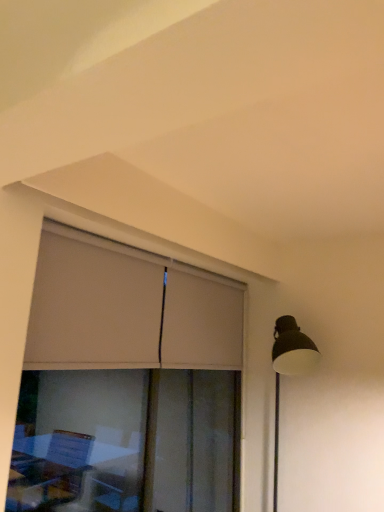
In order to click on beige fabric curtain at upper left in this screenshot , I will do `click(127, 309)`.

The width and height of the screenshot is (384, 512). Describe the element at coordinates (127, 309) in the screenshot. I see `beige fabric curtain at upper left` at that location.

In the scene shown: What is the approximate height of beige fabric curtain at upper left?

The height of beige fabric curtain at upper left is 26.19 inches.

Describe the element at coordinates (129, 309) in the screenshot. I see `matte beige window at center` at that location.

Find the location of a particular element. The height and width of the screenshot is (512, 384). matte beige window at center is located at coordinates tap(129, 309).

What are the coordinates of `beige fabric curtain at upper left` in the screenshot? It's located at (127, 309).

Which is more to the right, matte beige window at center or beige fabric curtain at upper left?

beige fabric curtain at upper left.

Considering the relative positions of matte beige window at center and beige fabric curtain at upper left in the image provided, is matte beige window at center in front of beige fabric curtain at upper left?

Yes, matte beige window at center is in front of beige fabric curtain at upper left.

Does point (130, 253) come in front of point (160, 354)?

Yes, point (130, 253) is closer to viewer.

Consider the image. From the image's perspective, is matte beige window at center beneath beige fabric curtain at upper left?

Correct, matte beige window at center appears lower than beige fabric curtain at upper left in the image.

From a real-world perspective, is matte beige window at center on top of beige fabric curtain at upper left?

No, from a real-world perspective, matte beige window at center is not on top of beige fabric curtain at upper left.

Between matte beige window at center and beige fabric curtain at upper left, which one has smaller width?

With smaller width is matte beige window at center.

Between matte beige window at center and beige fabric curtain at upper left, which one has less height?

beige fabric curtain at upper left is shorter.

Considering the sizes of objects matte beige window at center and beige fabric curtain at upper left in the image provided, who is smaller, matte beige window at center or beige fabric curtain at upper left?

Smaller between the two is beige fabric curtain at upper left.

Would you say matte beige window at center is inside or outside beige fabric curtain at upper left?

matte beige window at center can be found inside beige fabric curtain at upper left.

Is matte beige window at center in contact with beige fabric curtain at upper left?

Yes, matte beige window at center and beige fabric curtain at upper left clearly make contact.

Is matte beige window at center turned away from beige fabric curtain at upper left?

Correct, matte beige window at center is looking away from beige fabric curtain at upper left.

Locate an element on the screen. This screenshot has width=384, height=512. curtain behind the matte beige window at center is located at coordinates (127, 309).

Does beige fabric curtain at upper left appear on the left side of matte beige window at center?

In fact, beige fabric curtain at upper left is to the right of matte beige window at center.

Which object is more forward, beige fabric curtain at upper left or matte beige window at center?

matte beige window at center is in front.

Does point (79, 328) lie behind point (53, 329)?

Yes, point (79, 328) is farther from viewer.

From the image's perspective, who appears lower, beige fabric curtain at upper left or matte beige window at center?

From the image's view, matte beige window at center is below.

In the scene shown: From a real-world perspective, is beige fabric curtain at upper left physically located above or below matte beige window at center?

In terms of real-world spatial position, beige fabric curtain at upper left is above matte beige window at center.

Does beige fabric curtain at upper left have a greater width compared to matte beige window at center?

Yes, beige fabric curtain at upper left is wider than matte beige window at center.

Considering the sizes of objects beige fabric curtain at upper left and matte beige window at center in the image provided, who is taller, beige fabric curtain at upper left or matte beige window at center?

matte beige window at center.

Is beige fabric curtain at upper left bigger or smaller than matte beige window at center?

Considering their sizes, beige fabric curtain at upper left takes up less space than matte beige window at center.

Is matte beige window at center located within beige fabric curtain at upper left?

Indeed, matte beige window at center is located within beige fabric curtain at upper left.

Would you consider beige fabric curtain at upper left to be distant from matte beige window at center?

No, beige fabric curtain at upper left is not far from matte beige window at center.

Could you tell me if beige fabric curtain at upper left is turned towards matte beige window at center?

Yes, beige fabric curtain at upper left is aimed at matte beige window at center.

Can you tell me how much beige fabric curtain at upper left and matte beige window at center differ in facing direction?

0.00683 degrees.

In the scene shown: How distant is beige fabric curtain at upper left from matte beige window at center?

2.86 centimeters.

Locate an element on the screen. The width and height of the screenshot is (384, 512). curtain located behind the matte beige window at center is located at coordinates (127, 309).

Where is `window below the beige fabric curtain at upper left (from a real-world perspective)`? The width and height of the screenshot is (384, 512). window below the beige fabric curtain at upper left (from a real-world perspective) is located at coordinates (129, 309).

Where is `curtain behind the matte beige window at center`? Image resolution: width=384 pixels, height=512 pixels. curtain behind the matte beige window at center is located at coordinates (127, 309).